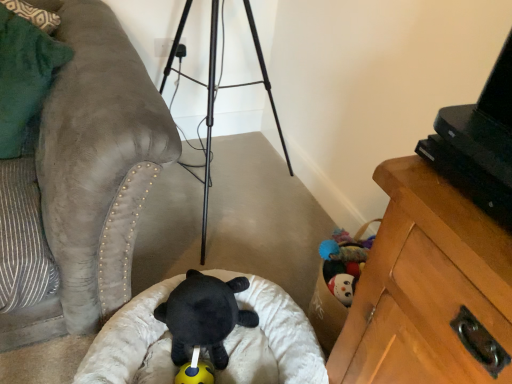
Question: Is black plush bear at center, the 1th toy from the top, wider or thinner than green suede pillow at left?

Choices:
 (A) wide
 (B) thin

Answer: (B)

Question: Considering the relative positions of black plush bear at center, which appears as the 2th toy when ordered from the bottom, and green suede pillow at left in the image provided, is black plush bear at center, which appears as the 2th toy when ordered from the bottom, to the left or to the right of green suede pillow at left?

Choices:
 (A) right
 (B) left

Answer: (A)

Question: Which object is the farthest from the green suede pillow at left?

Choices:
 (A) white plush infant bed at center
 (B) yellow rubber ball at center, placed as the 1th toy when sorted from bottom to top
 (C) black plush bear at center, which appears as the 2th toy when ordered from the bottom
 (D) black plastic tv at upper right

Answer: (D)

Question: Which object is the closest to the yellow rubber ball at center, placed as the 1th toy when sorted from bottom to top?

Choices:
 (A) black plush bear at center, the 1th toy from the top
 (B) black plastic tv at upper right
 (C) green suede pillow at left
 (D) white plush infant bed at center

Answer: (A)